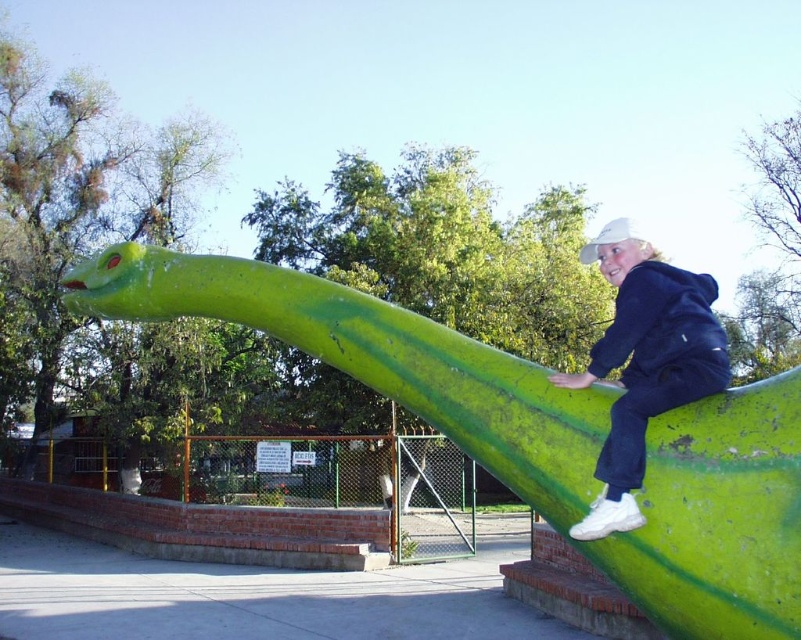
You are a parent supervising children at the park. You notice the green matte slide at upper right and the white matte sneakers at upper right. Which object is taller?

The green matte slide at upper right is taller than the white matte sneakers at upper right according to the description.

You are a parent trying to ensure your child can safely walk along the edge of the green matte slide at upper right while wearing their white matte sneakers at upper right. Based on the scene, can the child walk along the slide edge without their sneakers slipping off due to the slide being too narrow?

The green matte slide at upper right is wider than the white matte sneakers at upper right, so the child can walk along the edge safely without their sneakers slipping off due to the slide being narrow enough to support the sneakers.

You are a parent trying to locate your child who is playing near the green matte slide at upper right. Based on the coordinates provided, can you determine if the slide is positioned closer to the center or the edge of the park area?

The green matte slide at upper right is located at point (377, 362), which suggests it is closer to the center of the park area since coordinates near 0.5 typically indicate central positioning.